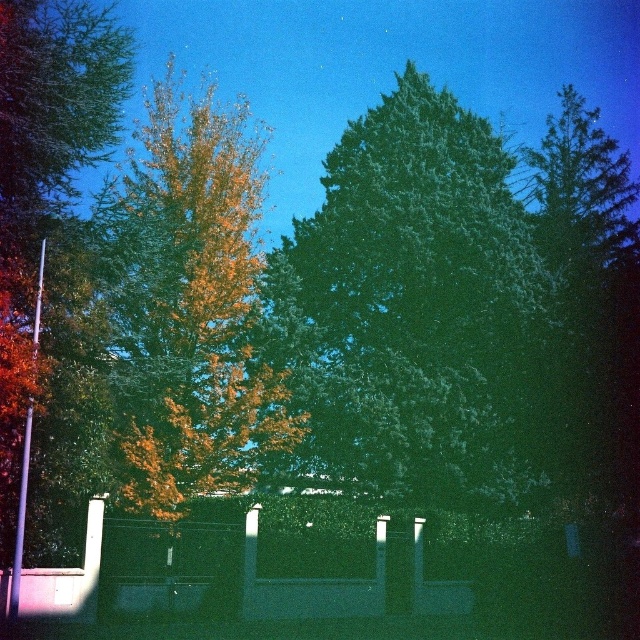
You are standing at the point with coordinates point (260, 401) and want to walk towards the point with coordinates point (346, 166). Which direction should you move in relation to the fence?

You should move towards the point (346, 166), which is behind the point (260, 401) relative to the fence. Since the point (346, 166) is behind the point (260, 401), you would need to move in a direction that goes past or around the fence structure to reach it.

You are standing in the forest and see the green leafy tree at center and the golden yellow leaves at center. Which tree is taller?

The golden yellow leaves at center are taller than the green leafy tree at center.

You are standing at the center of the image and want to walk towards the green leafy tree at center. Which direction should you face to ensure you are moving directly towards it?

Since the green leafy tree at center is located at point [416,310], you should face slightly to the right and forward to move directly towards it.